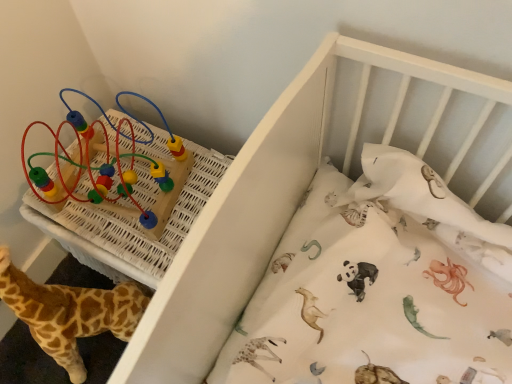
Question: Is soft plush giraffe at lower left in front of or behind white wooden crib at upper center in the image?

Choices:
 (A) behind
 (B) front

Answer: (A)

Question: From the image's perspective, relative to white wooden crib at upper center, is soft plush giraffe at lower left above or below?

Choices:
 (A) below
 (B) above

Answer: (A)

Question: Which is farther from the soft plush giraffe at lower left?

Choices:
 (A) multicolored plastic beads at upper left
 (B) white wooden crib at upper center

Answer: (B)

Question: Which object is positioned farthest from the soft plush giraffe at lower left?

Choices:
 (A) white wooden crib at upper center
 (B) multicolored plastic beads at upper left

Answer: (A)